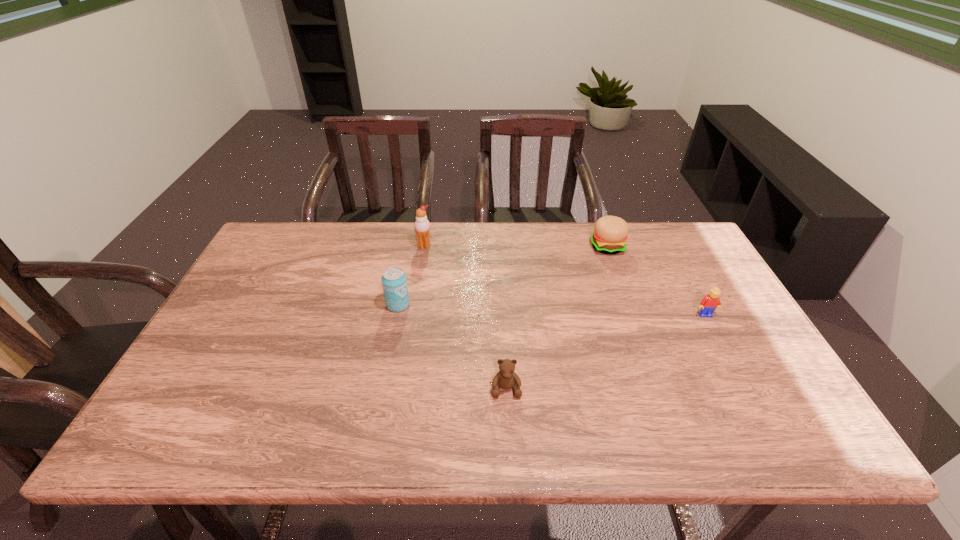
The width and height of the screenshot is (960, 540). I want to click on vacant area that lies between the beer can and the Lego, so click(x=552, y=310).

Where is `unoccupied area between the tallest object and the beer can`? unoccupied area between the tallest object and the beer can is located at coordinates (411, 275).

Locate an element on the screen. free spot between the beer can and the hamburger is located at coordinates [x=503, y=275].

Locate an element on the screen. This screenshot has height=540, width=960. empty space that is in between the beer can and the second object from right to left is located at coordinates (503, 275).

You are a GUI agent. You are given a task and a screenshot of the screen. Output one action in this format:
    pyautogui.click(x=<x>, y=<y>)
    Task: Click on the unoccupied position between the rightmost object and the nearest object
    The width and height of the screenshot is (960, 540).
    Given the screenshot: What is the action you would take?
    pyautogui.click(x=606, y=352)

This screenshot has height=540, width=960. I want to click on empty space between the third object from right to left and the second object from right to left, so (557, 318).

Where is `empty location between the beer can and the Lego`? This screenshot has height=540, width=960. empty location between the beer can and the Lego is located at coordinates (552, 310).

Where is `free space between the Lego and the fourth object from left to right`? free space between the Lego and the fourth object from left to right is located at coordinates pos(656,281).

Find the location of a particular element. vacant space that is in between the third object from left to right and the beer can is located at coordinates (452, 347).

Select which object is the second closest to the hamburger. Please provide its 2D coordinates. Your answer should be formatted as a tuple, i.e. [(x, y)], where the tuple contains the x and y coordinates of a point satisfying the conditions above.

[(422, 226)]